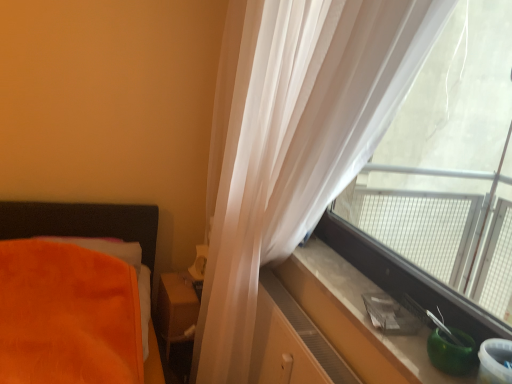
Where is `blank space situated above matte wood dresser at lower right (from a real-world perspective)`? blank space situated above matte wood dresser at lower right (from a real-world perspective) is located at coordinates (308, 316).